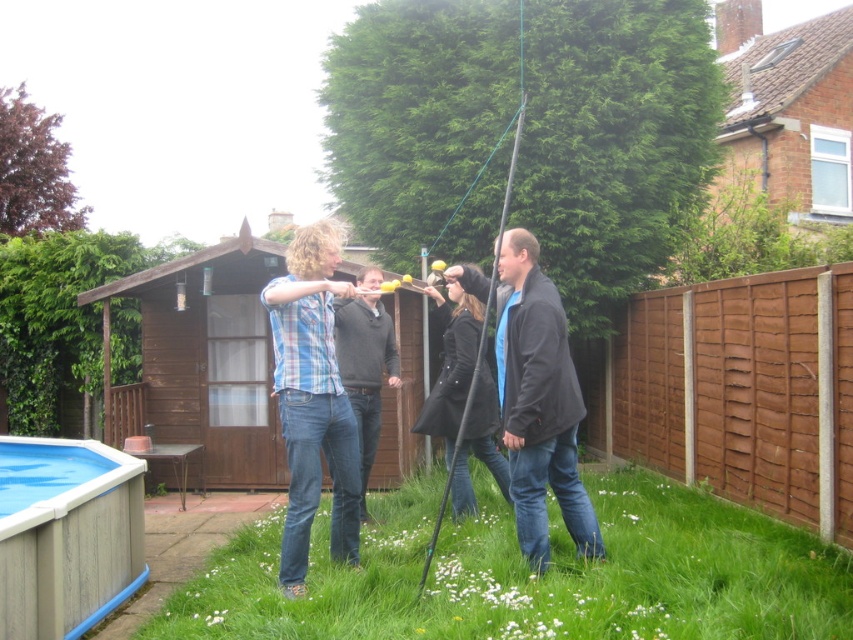
You are a delivery person carrying a large box that is 1 meter wide. You need to walk from the wooden fence on the right to the shed near the center left. There is a black leather jacket at center and a blue plastic pool at lower left in your path. Can your box fit through the space between these two objects?

→ The black leather jacket at center is thinner than the blue plastic pool at lower left. Since the box is 1 meter wide, it depends on the actual width of the space between them. However, the description only states the jacket is thinner than the pool, not the distance between them. Without specific measurements, we cannot confirm if the box will fit. Please check the actual distance.

You are standing in the backyard and want to retrieve your black leather jacket at center. You are currently near the blue plastic pool at lower left. Which direction should you move to reach the jacket?

The black leather jacket at center is to the right of the blue plastic pool at lower left, so you should move to your right to reach it.

You are standing at the center of the backyard and want to place a small garden gnome exactly where the green grass at lower center is located. According to the coordinates provided, where should you place the gnome?

You should place the gnome at point (531, 577) where the green grass at lower center is located.